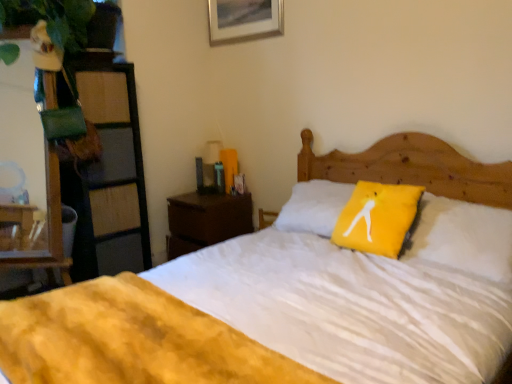
Where is `yellow fabric pillow at center`? yellow fabric pillow at center is located at coordinates (377, 218).

What do you see at coordinates (206, 220) in the screenshot? I see `brown wood nightstand at center` at bounding box center [206, 220].

Locate an element on the screen. The height and width of the screenshot is (384, 512). white soft bed at center is located at coordinates (413, 167).

Describe the element at coordinates (244, 18) in the screenshot. The height and width of the screenshot is (384, 512). I see `metallic silver picture frame at upper center` at that location.

What are the coordinates of `wooden dresser at left` in the screenshot? It's located at (109, 174).

From the image's perspective, relative to white soft bed at center, is wooden dresser at left above or below?

From the image's perspective, wooden dresser at left appears above white soft bed at center.

Is wooden dresser at left smaller than white soft bed at center?

Indeed, wooden dresser at left has a smaller size compared to white soft bed at center.

Which object is positioned more to the left, wooden dresser at left or white soft bed at center?

wooden dresser at left.

Between point (114, 106) and point (470, 178), which one is positioned behind?

Point (114, 106)

Can you confirm if white soft bed at center is taller than brown wood nightstand at center?

Indeed, white soft bed at center has a greater height compared to brown wood nightstand at center.

Considering the sizes of objects white soft bed at center and brown wood nightstand at center in the image provided, who is bigger, white soft bed at center or brown wood nightstand at center?

white soft bed at center.

Does white soft bed at center appear on the left side of brown wood nightstand at center?

Incorrect, white soft bed at center is not on the left side of brown wood nightstand at center.

Does white soft bed at center have a lesser width compared to brown wood nightstand at center?

No.

Locate an element on the screen. The image size is (512, 384). nightstand lying on the right of wooden dresser at left is located at coordinates (206, 220).

Who is more distant, wooden dresser at left or brown wood nightstand at center?

brown wood nightstand at center is behind.

From a real-world perspective, does wooden dresser at left stand above brown wood nightstand at center?

Yes, from a real-world perspective, wooden dresser at left is on top of brown wood nightstand at center.

Is point (85, 278) closer to camera compared to point (170, 255)?

Yes, it is in front of point (170, 255).

Where is `nightstand below the wooden dresser at left (from a real-world perspective)`? nightstand below the wooden dresser at left (from a real-world perspective) is located at coordinates (206, 220).

Is the surface of brown wood nightstand at center in direct contact with wooden dresser at left?

They are not placed beside each other.

From the image's perspective, which one is positioned higher, brown wood nightstand at center or wooden dresser at left?

wooden dresser at left.

Considering their positions, is brown wood nightstand at center located in front of or behind wooden dresser at left?

brown wood nightstand at center is behind wooden dresser at left.

Measure the distance from white soft bed at center to wooden dresser at left.

white soft bed at center is 4.44 feet from wooden dresser at left.

Locate an element on the screen. bed that appears below the wooden dresser at left (from a real-world perspective) is located at coordinates (413, 167).

Is point (391, 164) in front of point (145, 202)?

Yes, it is in front of point (145, 202).

Is white soft bed at center looking in the opposite direction of wooden dresser at left?

white soft bed at center does not have its back to wooden dresser at left.

Considering the sizes of objects brown wood nightstand at center and metallic silver picture frame at upper center in the image provided, who is smaller, brown wood nightstand at center or metallic silver picture frame at upper center?

With smaller size is metallic silver picture frame at upper center.

Is point (187, 250) behind point (233, 33)?

No, (187, 250) is in front of (233, 33).

Considering the sizes of brown wood nightstand at center and metallic silver picture frame at upper center in the image, is brown wood nightstand at center taller or shorter than metallic silver picture frame at upper center?

Considering their sizes, brown wood nightstand at center has more height than metallic silver picture frame at upper center.

Is brown wood nightstand at center completely or partially outside of metallic silver picture frame at upper center?

Yes.

Can you confirm if yellow fabric pillow at center is thinner than white soft bed at center?

Yes.

Is yellow fabric pillow at center taller or shorter than white soft bed at center?

Clearly, yellow fabric pillow at center is shorter compared to white soft bed at center.

The image size is (512, 384). I want to click on dresser above the white soft bed at center (from the image's perspective), so click(x=109, y=174).

Identify the location of nightstand directly beneath the white soft bed at center (from a real-world perspective). The height and width of the screenshot is (384, 512). (206, 220).

From the image, which object appears to be nearer to metallic silver picture frame at upper center, white soft bed at center or wooden dresser at left?

white soft bed at center is closer to metallic silver picture frame at upper center.

Based on their spatial positions, is yellow fabric pillow at center or wooden dresser at left closer to metallic silver picture frame at upper center?

wooden dresser at left.

Looking at the image, which one is located closer to yellow fabric pillow at center, wooden dresser at left or white soft bed at center?

white soft bed at center is closer to yellow fabric pillow at center.

Which object lies further to the anchor point wooden dresser at left, metallic silver picture frame at upper center or brown wood nightstand at center?

metallic silver picture frame at upper center is positioned further to the anchor wooden dresser at left.

Estimate the real-world distances between objects in this image. Which object is closer to wooden dresser at left, yellow fabric pillow at center or brown wood nightstand at center?

Among the two, brown wood nightstand at center is located nearer to wooden dresser at left.

Which object lies nearer to the anchor point white soft bed at center, brown wood nightstand at center or wooden dresser at left?

brown wood nightstand at center is positioned closer to the anchor white soft bed at center.

Consider the image. When comparing their distances from wooden dresser at left, does brown wood nightstand at center or yellow fabric pillow at center seem further?

Based on the image, yellow fabric pillow at center appears to be further to wooden dresser at left.

From the image, which object appears to be nearer to metallic silver picture frame at upper center, yellow fabric pillow at center or white soft bed at center?

white soft bed at center is positioned closer to the anchor metallic silver picture frame at upper center.

Image resolution: width=512 pixels, height=384 pixels. I want to click on picture frame located between white soft bed at center and brown wood nightstand at center in the depth direction, so click(x=244, y=18).

Where is `dresser between white soft bed at center and brown wood nightstand at center along the z-axis`? dresser between white soft bed at center and brown wood nightstand at center along the z-axis is located at coordinates (109, 174).

Identify the location of pillow located between white soft bed at center and metallic silver picture frame at upper center in the depth direction. (377, 218).

In order to click on dresser between metallic silver picture frame at upper center and brown wood nightstand at center vertically in this screenshot , I will do `click(109, 174)`.